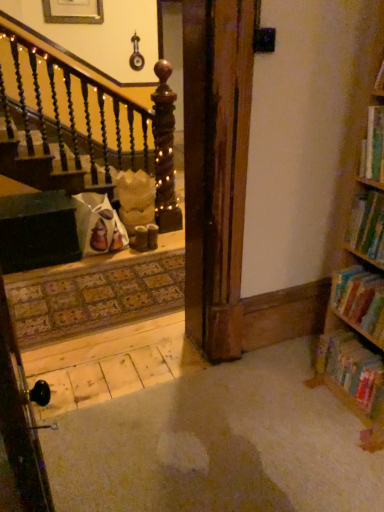
Question: Considering the relative positions of green matte bookshelf at right, which is the third book from bottom to top, and multicolored cardboard book at lower right, which is the 4th book from top to bottom, in the image provided, is green matte bookshelf at right, which is the third book from bottom to top, to the left or to the right of multicolored cardboard book at lower right, which is the 4th book from top to bottom,?

Choices:
 (A) right
 (B) left

Answer: (A)

Question: Is green matte bookshelf at right, which ranks as the second book in top-to-bottom order, bigger or smaller than multicolored cardboard book at lower right, arranged as the first book when ordered from the bottom?

Choices:
 (A) big
 (B) small

Answer: (B)

Question: Based on their relative distances, which object is farther from the hardcover book at upper right, the 4th book when ordered from bottom to top?

Choices:
 (A) hardcover book at right, which appears as the 3th book when viewed from the top
 (B) multicolored cardboard book at lower right, arranged as the first book when ordered from the bottom
 (C) green matte bookshelf at right, which is the third book from bottom to top

Answer: (B)

Question: Considering the real-world distances, which object is farthest from the hardcover book at upper right, the 4th book when ordered from bottom to top?

Choices:
 (A) hardcover book at right, which appears as the 3th book when viewed from the top
 (B) green matte bookshelf at right, which ranks as the second book in top-to-bottom order
 (C) multicolored cardboard book at lower right, arranged as the first book when ordered from the bottom

Answer: (C)